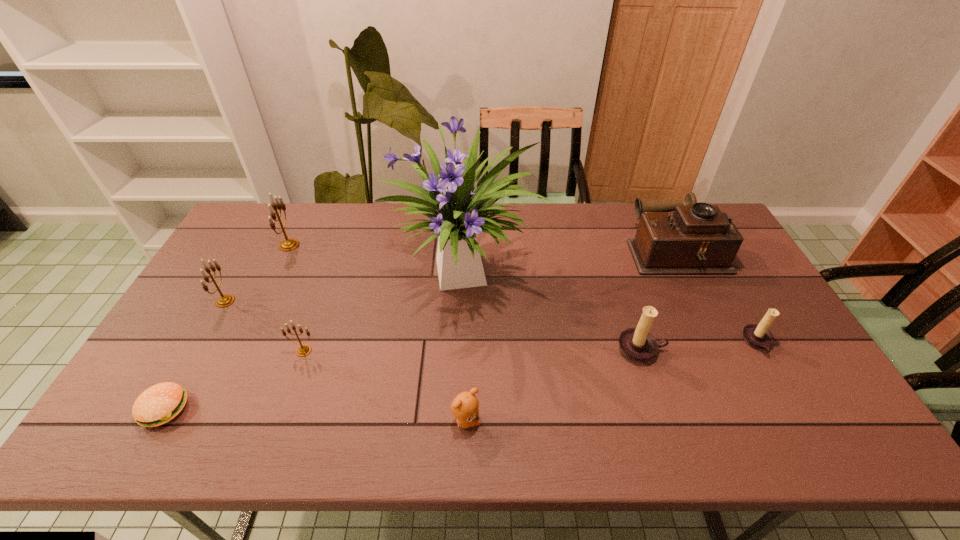
The height and width of the screenshot is (540, 960). What are the coordinates of `free spot that satisfies the following two spatial constraints: 1. on the back side of the brown patty; 2. on the right side of the flower arrangement` in the screenshot? It's located at (241, 274).